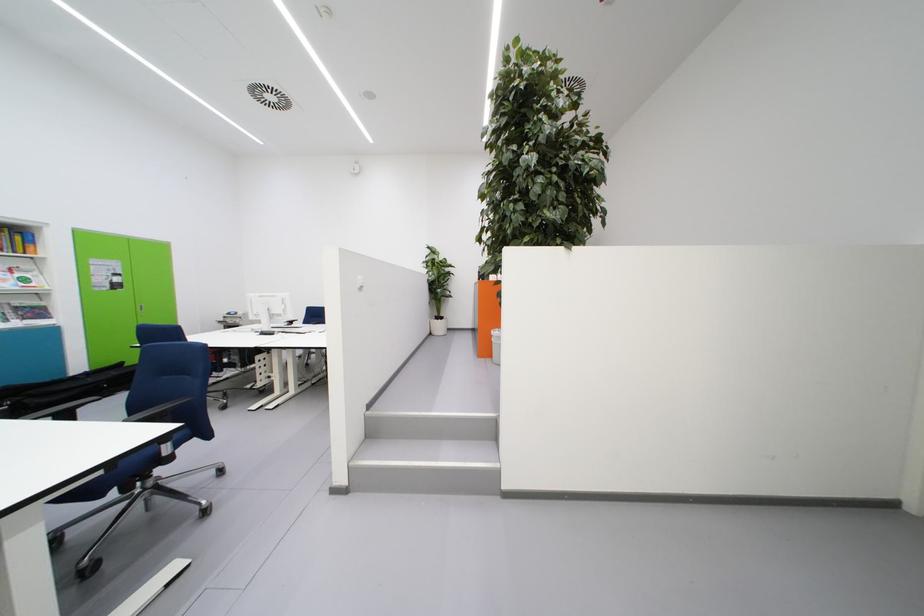
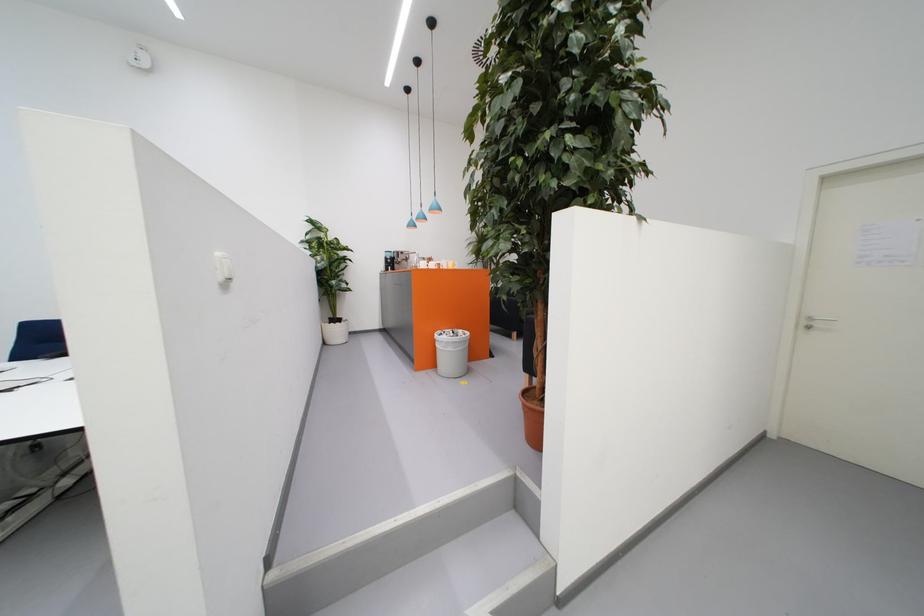
The images are taken continuously from a first-person perspective. In which direction are you moving?

The cameraman walked toward left, forward.